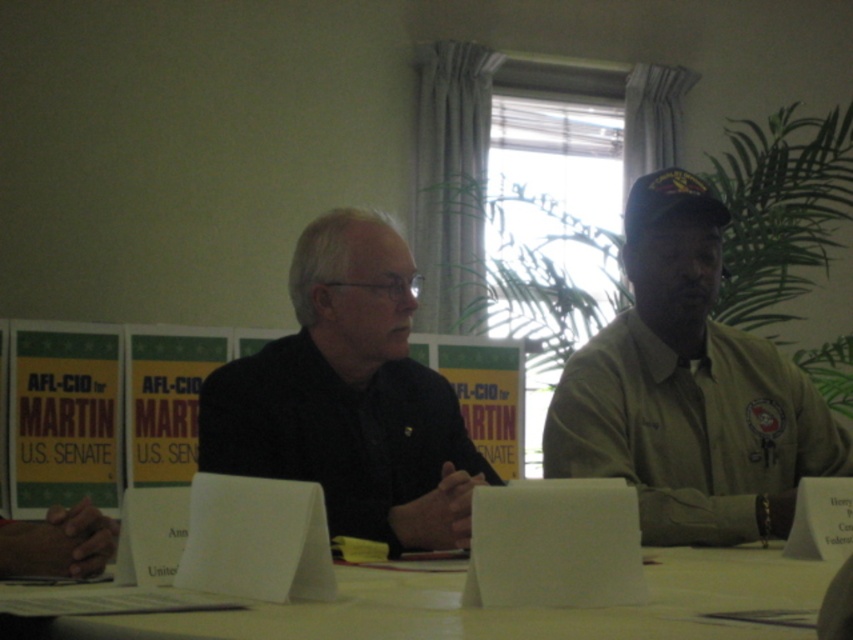
Question: Can you confirm if khaki uniform at center is positioned to the left of white paper at center?

Choices:
 (A) no
 (B) yes

Answer: (A)

Question: Is khaki uniform at center above white paper at center?

Choices:
 (A) no
 (B) yes

Answer: (B)

Question: Does khaki uniform at center appear on the right side of black matte shirt at center?

Choices:
 (A) yes
 (B) no

Answer: (A)

Question: Which object is positioned farthest from the white paper at center?

Choices:
 (A) black matte shirt at center
 (B) khaki uniform at center

Answer: (B)

Question: Which object appears closest to the camera in this image?

Choices:
 (A) khaki uniform at center
 (B) white paper at center
 (C) black matte shirt at center

Answer: (B)

Question: Among these points, which one is nearest to the camera?

Choices:
 (A) (825, 572)
 (B) (364, 529)
 (C) (773, 432)

Answer: (A)